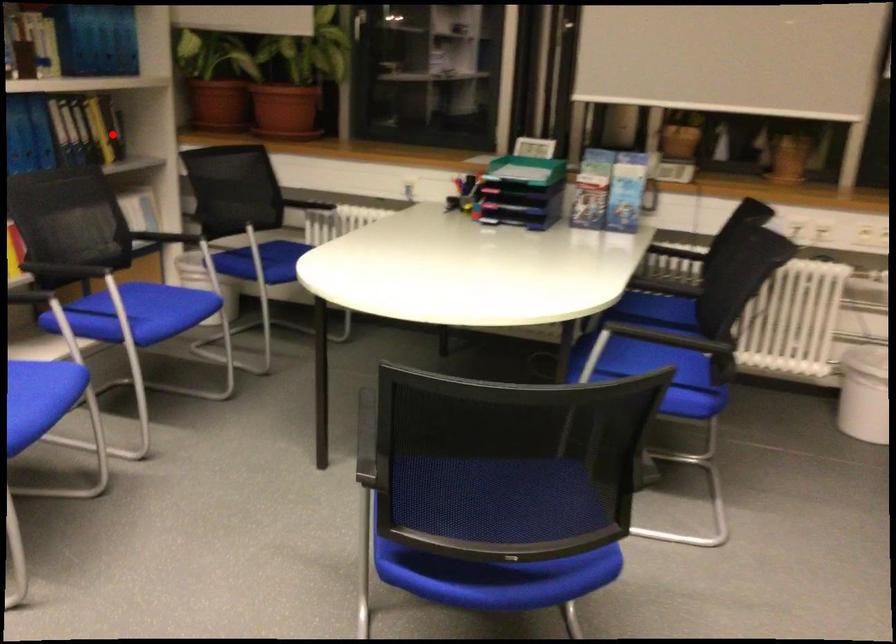
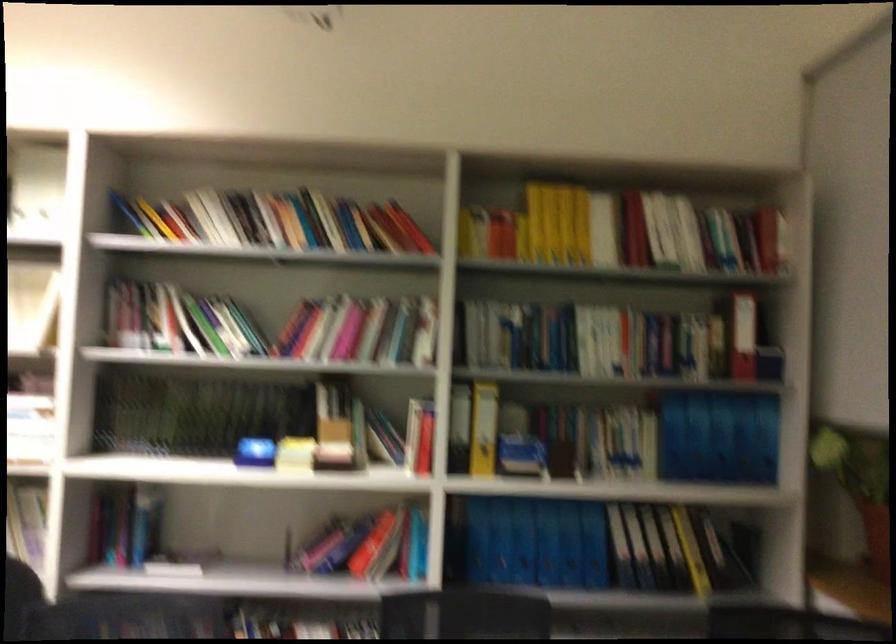
Question: I am providing you with two images of the same scene from different viewpoints. Image1 has a red point marked. In image2, the corresponding 3D location appears at what relative position? Reply with the corresponding letter.

Choices:
 (A) Closer
 (B) Farther

Answer: (A)